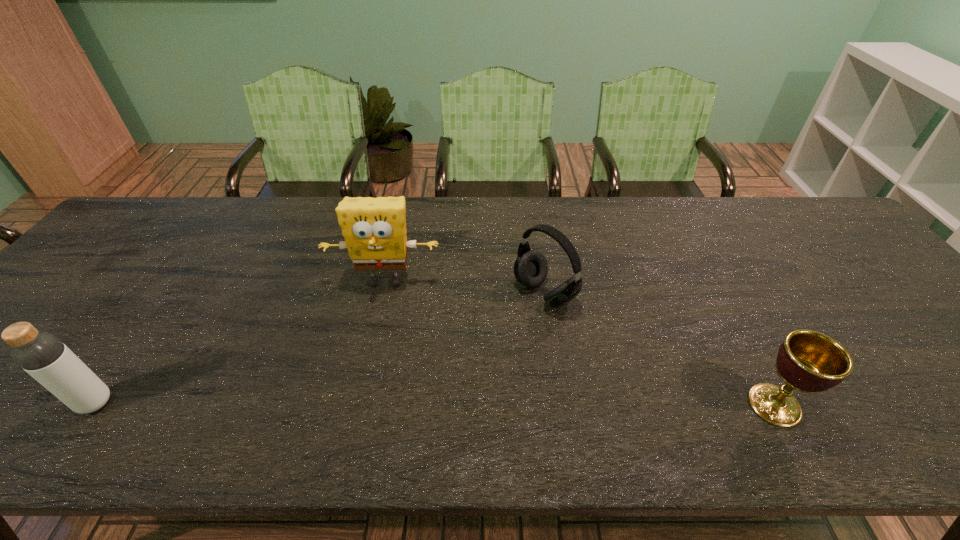
Where is `free space between the rightmost object and the leftmost object`? This screenshot has width=960, height=540. free space between the rightmost object and the leftmost object is located at coordinates (x=435, y=404).

Image resolution: width=960 pixels, height=540 pixels. What are the coordinates of `empty space that is in between the headset and the leftmost object` in the screenshot? It's located at (321, 348).

The height and width of the screenshot is (540, 960). What are the coordinates of `free space between the bottle and the chalice` in the screenshot? It's located at (435, 404).

Locate an element on the screen. Image resolution: width=960 pixels, height=540 pixels. free spot between the sponge and the headset is located at coordinates (465, 287).

Identify the location of free space that is in between the chalice and the second object from right to left. This screenshot has width=960, height=540. (660, 349).

The width and height of the screenshot is (960, 540). Identify the location of vacant area that lies between the rightmost object and the leftmost object. (435, 404).

You are a GUI agent. You are given a task and a screenshot of the screen. Output one action in this format:
    pyautogui.click(x=<x>, y=<y>)
    Task: Click on the free area in between the sponge and the bottle
    
    Given the screenshot: What is the action you would take?
    pyautogui.click(x=240, y=342)

Point out which object is positioned as the second nearest to the headset. Please provide its 2D coordinates. Your answer should be formatted as a tuple, i.e. [(x, y)], where the tuple contains the x and y coordinates of a point satisfying the conditions above.

[(808, 361)]

At what (x,y) coordinates should I click in order to perform the action: click on object that is the closest to the rightmost object. Please return your answer as a coordinate pair (x, y). The image size is (960, 540). Looking at the image, I should click on (530, 268).

This screenshot has height=540, width=960. In order to click on free spot that satisfies the following two spatial constraints: 1. on the back side of the second object from right to left; 2. on the left side of the bottle in this screenshot , I will do (x=172, y=293).